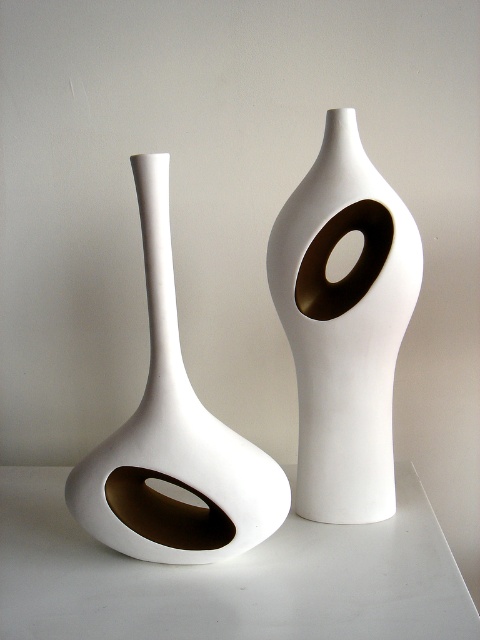
You are an interior designer arranging items on a shelf. You have a white glossy vase at center and a matte gold ring at center. If you want to create a vertical focal point, which item should you place higher to emphasize its height?

The white glossy vase at center is taller than the matte gold ring at center, so placing it higher will emphasize its height and create a vertical focal point.

You are setting up a display and need to place a small figurine that requires a flat surface. Given the scene described, which object between the white matte table at lower left and the white glossy vase at center would be more suitable for placing the figurine?

The white matte table at lower left has a lesser height compared to the white glossy vase at center, so the table is shorter. Since the figurine needs a flat surface, the white matte table at lower left would be more suitable as it provides a stable, level surface at a lower height compared to the vase.